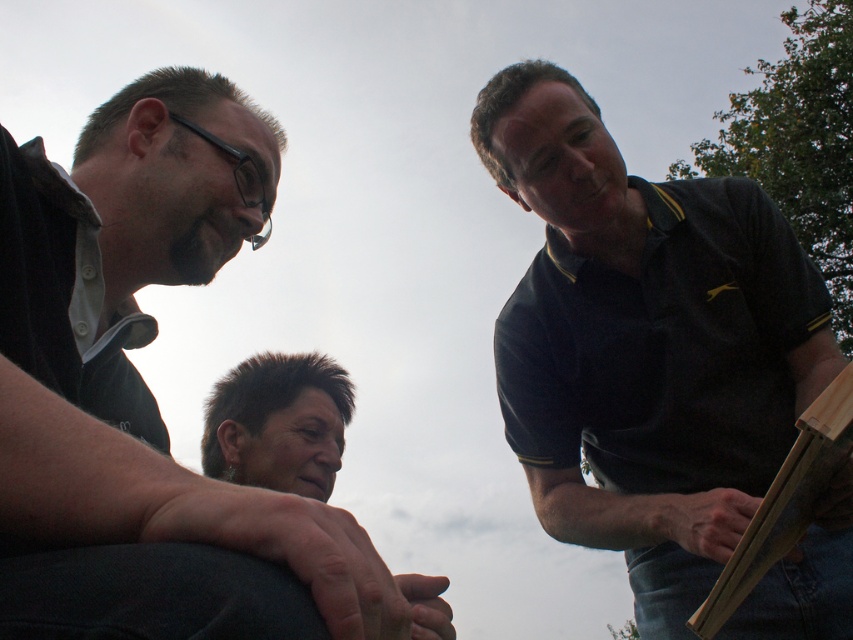
You are a photographer trying to capture a photo of the matte black shirt at left and the wooden frame at right. Based on their sizes, which object should you focus on first to ensure both fit in the frame?

The matte black shirt at left is larger than the wooden frame at right, so you should focus on the matte black shirt at left first to ensure it fits in the frame, then adjust to include the smaller wooden frame at right.

You are standing at the camera position and want to pick up the object at point (x=79, y=257). Can you reach it without moving your feet?

The distance between you and the object at point (x=79, y=257) is 1.11 meters. Since the average human arm length is about 0.7 meters, you cannot reach it without moving your feet.